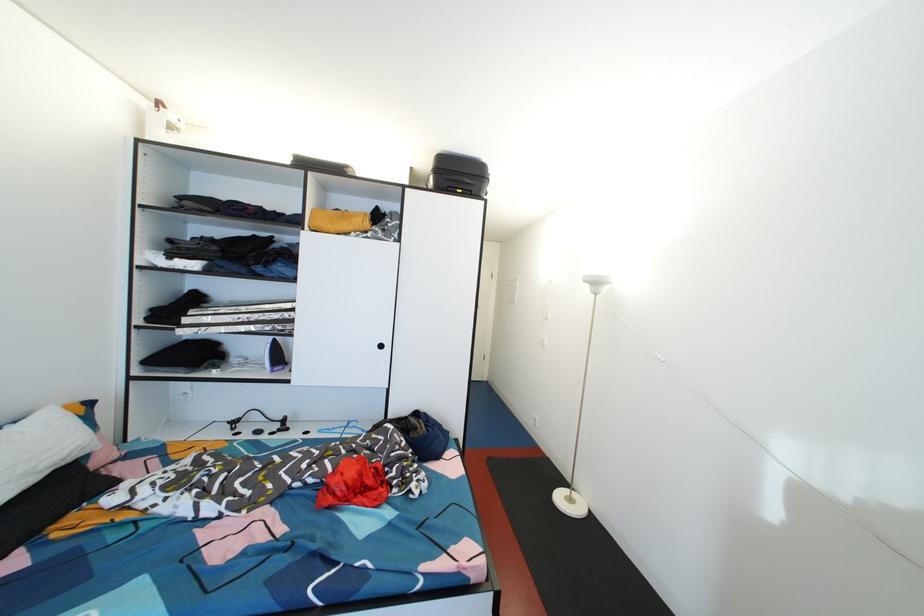
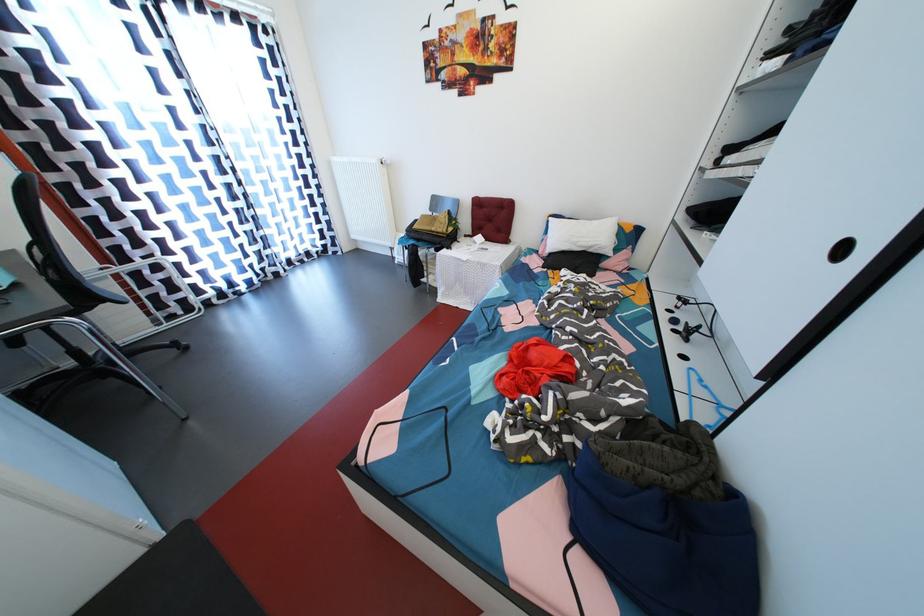
Locate, in the second image, the point that corresponds to pixel 387 351 in the first image.

(848, 254)